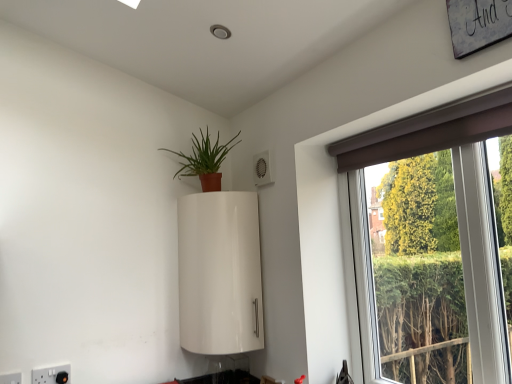
Question: Does white plastic electric outlet at lower left, the 2th electric outlet positioned from the left, appear on the left side of brown fabric window at upper right?

Choices:
 (A) no
 (B) yes

Answer: (B)

Question: Considering the relative sizes of white plastic electric outlet at lower left, the 2th electric outlet positioned from the left, and brown fabric window at upper right in the image provided, is white plastic electric outlet at lower left, the 2th electric outlet positioned from the left, wider than brown fabric window at upper right?

Choices:
 (A) no
 (B) yes

Answer: (A)

Question: Can you confirm if white plastic electric outlet at lower left, positioned as the 2th electric outlet in front-to-back order, is bigger than brown fabric window at upper right?

Choices:
 (A) yes
 (B) no

Answer: (B)

Question: Does white plastic electric outlet at lower left, positioned as the 2th electric outlet in front-to-back order, appear on the right side of brown fabric window at upper right?

Choices:
 (A) no
 (B) yes

Answer: (A)

Question: Does white plastic electric outlet at lower left, which is the first electric outlet in right-to-left order, have a smaller size compared to brown fabric window at upper right?

Choices:
 (A) no
 (B) yes

Answer: (B)

Question: Is white plastic electric outlet at lower left, positioned as the 2th electric outlet in front-to-back order, oriented away from brown fabric window at upper right?

Choices:
 (A) yes
 (B) no

Answer: (B)

Question: From the image's perspective, is white plastic electric outlet at lower left, placed as the first electric outlet when sorted from left to right, under white glossy cabinet at upper center?

Choices:
 (A) yes
 (B) no

Answer: (A)

Question: From the image's perspective, is white plastic electric outlet at lower left, which is the 2th electric outlet in back-to-front order, on top of white glossy cabinet at upper center?

Choices:
 (A) no
 (B) yes

Answer: (A)

Question: Does white plastic electric outlet at lower left, the first electric outlet viewed from the front, have a larger size compared to white glossy cabinet at upper center?

Choices:
 (A) yes
 (B) no

Answer: (B)

Question: Is white plastic electric outlet at lower left, which is counted as the second electric outlet, starting from the right, shorter than white glossy cabinet at upper center?

Choices:
 (A) yes
 (B) no

Answer: (A)

Question: Does white plastic electric outlet at lower left, which is counted as the second electric outlet, starting from the right, turn towards white glossy cabinet at upper center?

Choices:
 (A) yes
 (B) no

Answer: (B)

Question: Considering the relative sizes of white plastic electric outlet at lower left, placed as the first electric outlet when sorted from left to right, and white glossy cabinet at upper center in the image provided, is white plastic electric outlet at lower left, placed as the first electric outlet when sorted from left to right, thinner than white glossy cabinet at upper center?

Choices:
 (A) yes
 (B) no

Answer: (A)

Question: Is white plastic electric outlet at lower left, which is the first electric outlet in right-to-left order, smaller than matte terracotta pot at upper center?

Choices:
 (A) no
 (B) yes

Answer: (B)